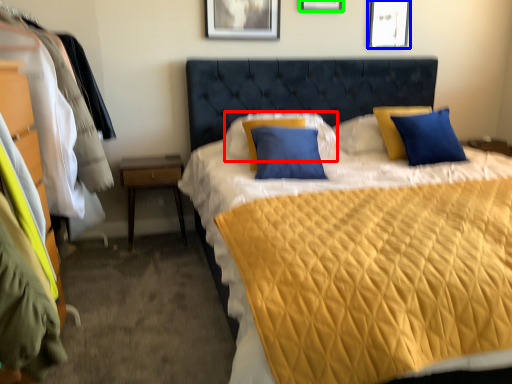
Question: Which object is positioned closest to pillow (highlighted by a red box)? Select from picture frame (highlighted by a blue box) and picture frame (highlighted by a green box).

Choices:
 (A) picture frame
 (B) picture frame

Answer: (B)